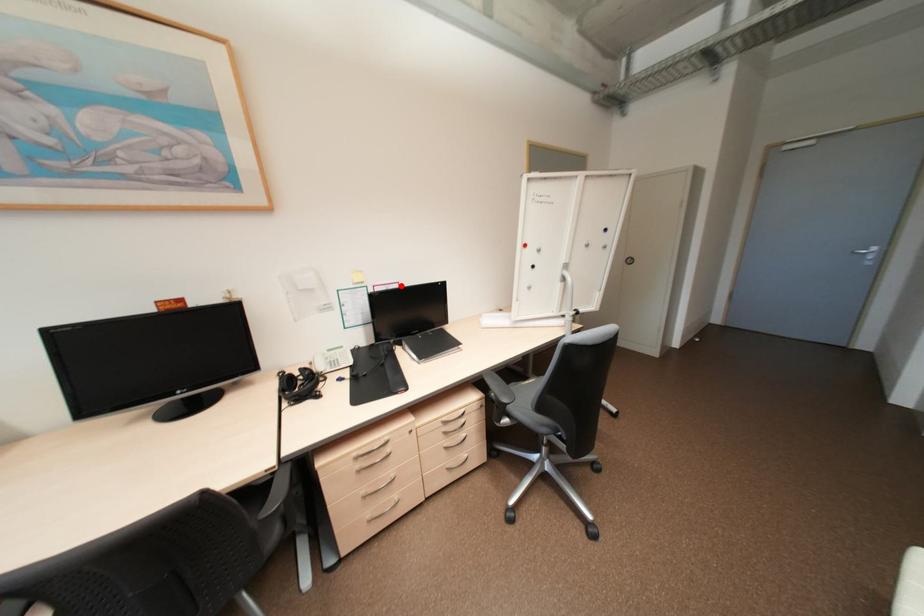
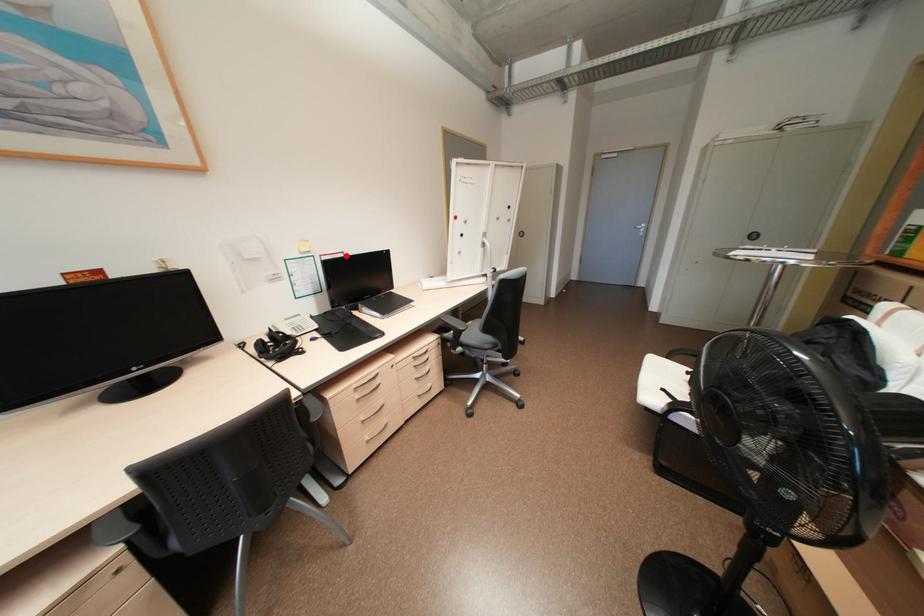
I am providing you with two images of the same scene from different viewpoints. A red point is marked on the first image and another point is marked on the second image. Is the marked point in image1 the same physical position as the marked point in image2?

Yes